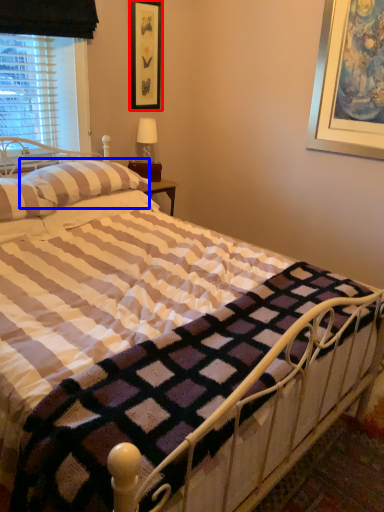
Question: Among these objects, which one is nearest to the camera, picture frame (highlighted by a red box) or pillow (highlighted by a blue box)?

Choices:
 (A) picture frame
 (B) pillow

Answer: (B)